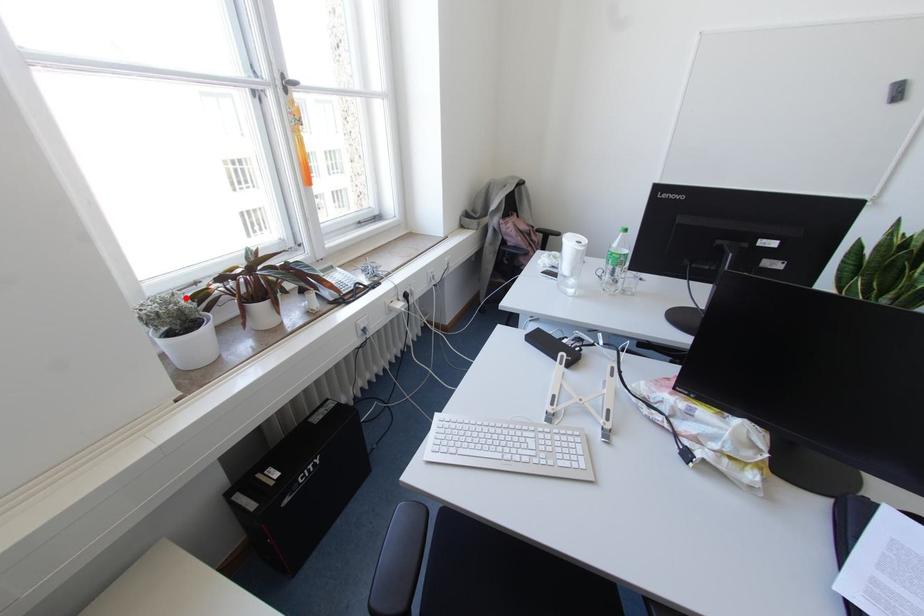
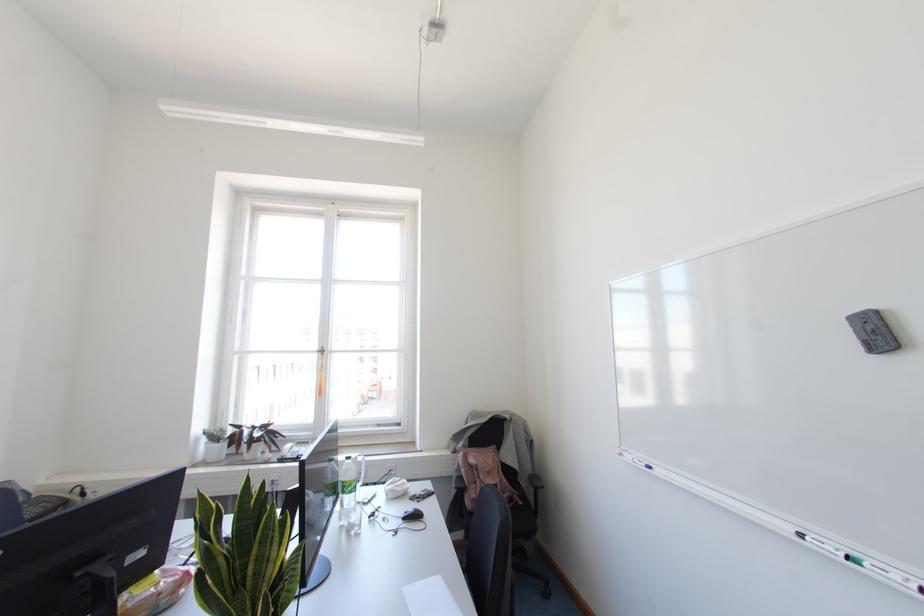
Where in the second image is the point corresponding to the highlighted location from the first image?

(223, 431)